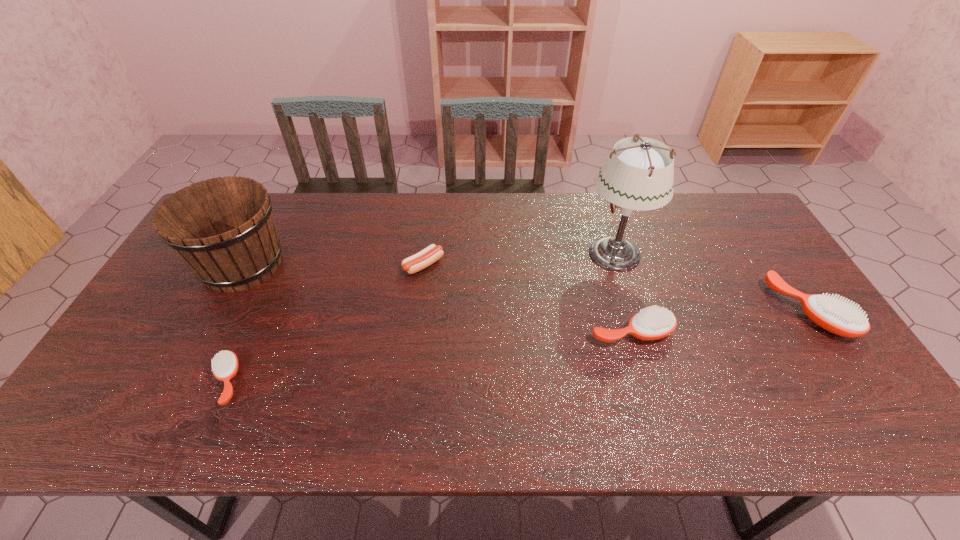
Where is `vacant area situated on the left of the rightmost object`? The height and width of the screenshot is (540, 960). vacant area situated on the left of the rightmost object is located at coordinates (669, 310).

Locate an element on the screen. This screenshot has width=960, height=540. free point located on the lampshade of the lampshade is located at coordinates (468, 253).

At what (x,y) coordinates should I click in order to perform the action: click on free space located 0.150m on the lampshade of the lampshade. Please return your answer as a coordinate pair (x, y). The height and width of the screenshot is (540, 960). Looking at the image, I should click on (533, 253).

I want to click on free region located on the lampshade of the lampshade, so click(529, 253).

The width and height of the screenshot is (960, 540). I want to click on vacant space located 0.210m on the left of the fourth object from right to left, so click(x=334, y=265).

What are the coordinates of `blank space located 0.090m on the right of the fifth shortest object` in the screenshot? It's located at (320, 265).

Locate an element on the screen. lampshade located in the far edge section of the desktop is located at coordinates (639, 175).

This screenshot has height=540, width=960. Find the location of `wine bucket present at the far edge`. wine bucket present at the far edge is located at coordinates (223, 228).

Find the location of `object situated at the near edge`. object situated at the near edge is located at coordinates (225, 364).

Find the location of a particular element. The image size is (960, 540). object at the left edge is located at coordinates (x=223, y=228).